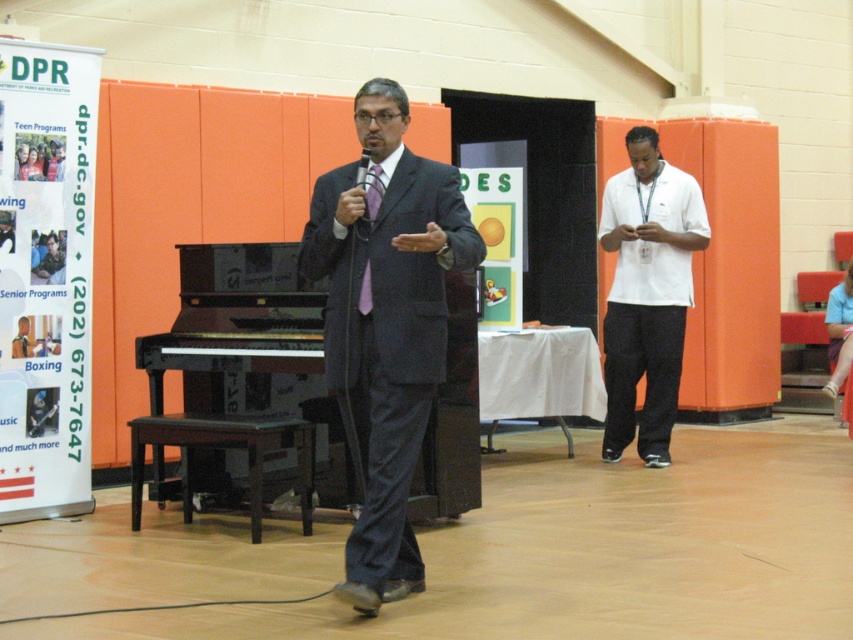
Question: Is matte black suit at center positioned at the back of purple satin tie at center?

Choices:
 (A) no
 (B) yes

Answer: (A)

Question: Is black polished piano at center further to camera compared to purple satin tie at center?

Choices:
 (A) yes
 (B) no

Answer: (A)

Question: Which of the following is the closest to the observer?

Choices:
 (A) purple satin tie at center
 (B) black polished piano at center
 (C) matte black suit at center

Answer: (C)

Question: Does matte black suit at center appear on the right side of purple satin tie at center?

Choices:
 (A) no
 (B) yes

Answer: (B)

Question: Which point is farther from the camera taking this photo?

Choices:
 (A) (248, 456)
 (B) (358, 292)
 (C) (198, 467)

Answer: (C)

Question: Which point is closer to the camera?

Choices:
 (A) dark brown wooden stool at lower left
 (B) matte black suit at center

Answer: (B)